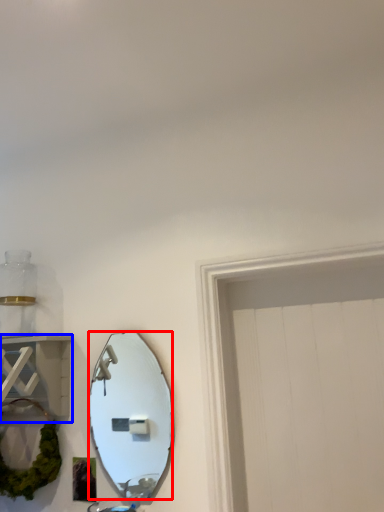
Question: Which object appears farthest to the camera in this image, mirror (highlighted by a red box) or cabinet (highlighted by a blue box)?

Choices:
 (A) mirror
 (B) cabinet

Answer: (A)